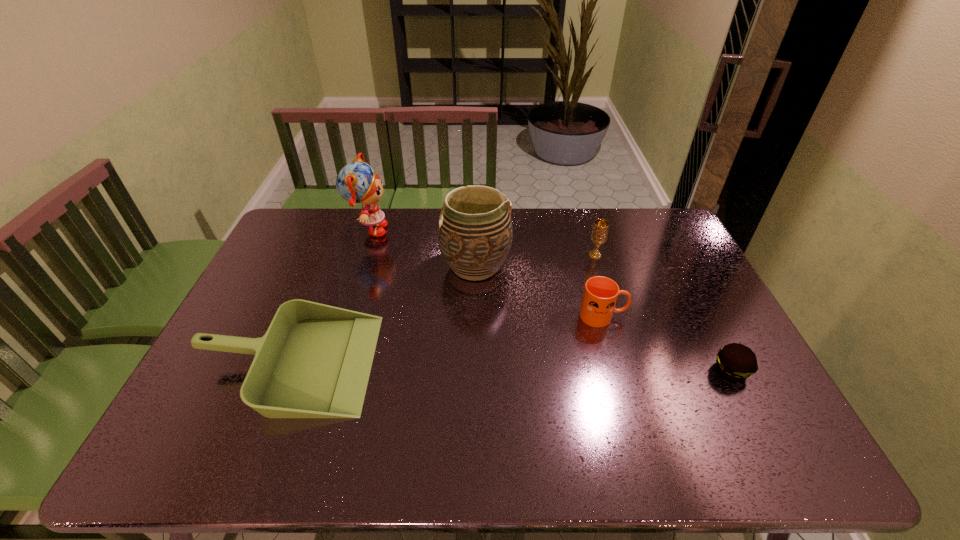
At what (x,y) coordinates should I click in order to perform the action: click on free region located on the handle side of the mug. Please return your answer as a coordinate pair (x, y). This screenshot has height=540, width=960. Looking at the image, I should click on (697, 316).

Identify the location of vacant area located on the scoop of the dustpan. This screenshot has width=960, height=540. (470, 362).

Identify the location of blank area located on the left of the rightmost object. (694, 370).

The height and width of the screenshot is (540, 960). In order to click on doll positioned at the far edge in this screenshot , I will do `click(356, 182)`.

This screenshot has height=540, width=960. In order to click on pottery present at the far edge in this screenshot , I will do `click(474, 231)`.

The width and height of the screenshot is (960, 540). I want to click on object that is at the left edge, so click(x=314, y=361).

This screenshot has height=540, width=960. I want to click on object present at the right edge, so coord(735,361).

This screenshot has height=540, width=960. I want to click on blank area at the far edge, so click(372, 237).

You are a GUI agent. You are given a task and a screenshot of the screen. Output one action in this format:
    pyautogui.click(x=<x>, y=<y>)
    Task: Click on the vacant space at the near edge of the desktop
    The height and width of the screenshot is (540, 960).
    Given the screenshot: What is the action you would take?
    click(x=548, y=454)

This screenshot has width=960, height=540. In the image, there is a desktop. What are the coordinates of `vacant space at the left edge` in the screenshot? It's located at (242, 304).